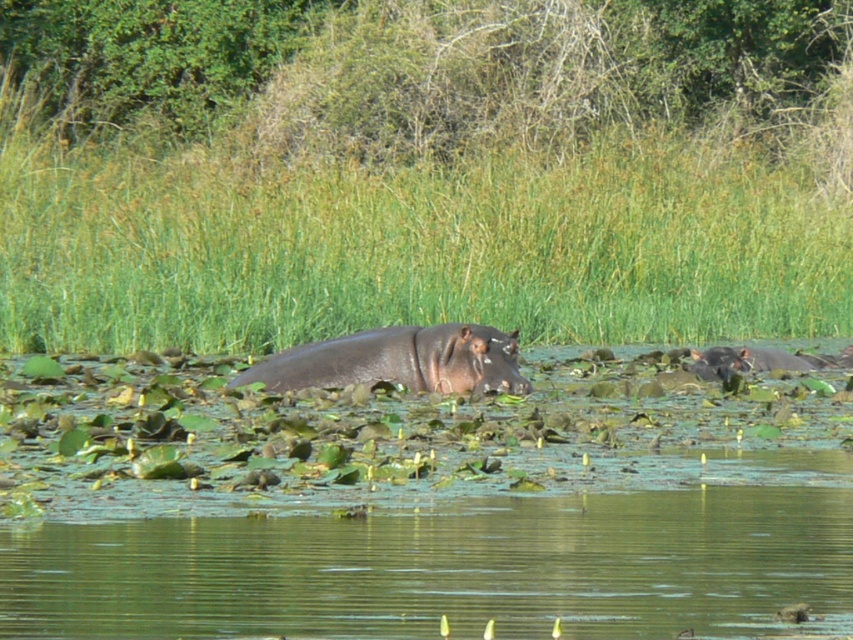
Question: Is the position of greenish water at center less distant than that of sleek dark brown hippo at center?

Choices:
 (A) yes
 (B) no

Answer: (A)

Question: Which is farther from the green grass at center?

Choices:
 (A) dark gray skin at right
 (B) sleek dark brown hippo at center
 (C) greenish water at center

Answer: (C)

Question: Which object appears farthest from the camera in this image?

Choices:
 (A) sleek dark brown hippo at center
 (B) dark gray skin at right
 (C) green grass at center

Answer: (C)

Question: Among these points, which one is farthest from the camera?

Choices:
 (A) (436, 566)
 (B) (329, 284)
 (C) (717, 346)
 (D) (492, 353)

Answer: (C)

Question: Is green grass at center smaller than sleek dark brown hippo at center?

Choices:
 (A) yes
 (B) no

Answer: (B)

Question: Does sleek dark brown hippo at center appear on the right side of dark gray skin at right?

Choices:
 (A) no
 (B) yes

Answer: (A)